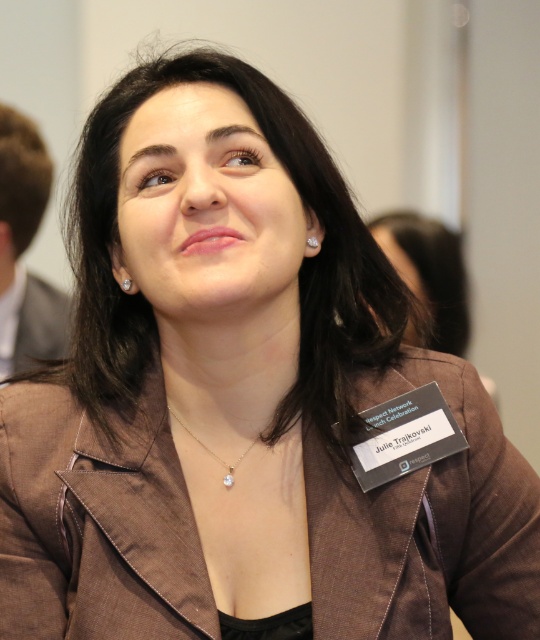
Does white cotton shirt at left appear on the left side of clear crystal pendant at center?

Correct, you'll find white cotton shirt at left to the left of clear crystal pendant at center.

In order to click on white cotton shirt at left in this screenshot , I will do `click(10, 320)`.

The image size is (540, 640). Find the location of `white cotton shirt at left`. white cotton shirt at left is located at coordinates (10, 320).